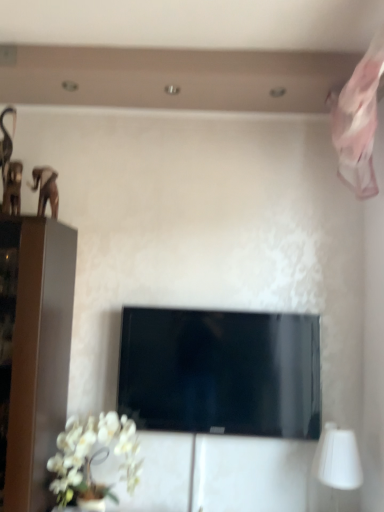
Question: Would you say white matte table lamp at lower right is inside or outside black glossy tv at center?

Choices:
 (A) inside
 (B) outside

Answer: (B)

Question: Is point (329, 468) positioned closer to the camera than point (256, 412)?

Choices:
 (A) farther
 (B) closer

Answer: (B)

Question: Which of these objects is positioned closest to the white matte table lamp at lower right?

Choices:
 (A) white matte orchid at lower left
 (B) black glossy tv at center

Answer: (B)

Question: Estimate the real-world distances between objects in this image. Which object is closer to the white matte orchid at lower left?

Choices:
 (A) white matte table lamp at lower right
 (B) black glossy tv at center

Answer: (B)